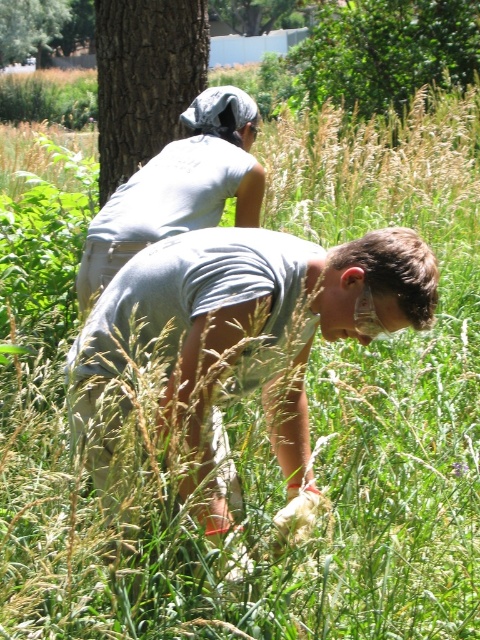
You are a photographer trying to capture both the gray matte shirt at upper center and the brown rough tree trunk at upper left in the same frame. Based on their heights, will the tree trunk appear taller than the shirt in the photo?

The gray matte shirt at upper center is shorter than the brown rough tree trunk at upper left, so yes, the tree trunk will appear taller than the shirt in the photo.

You are a photographer trying to capture both the gray matte shirt at upper center and the brown rough tree at upper left in the same frame. Based on their sizes, which object should you focus on first to ensure both fit in the photo?

The gray matte shirt at upper center is wider than the brown rough tree at upper left. To ensure both fit in the photo, focus on framing the wider gray matte shirt at upper center first, then adjust to include the narrower brown rough tree at upper left.

You are a photographer trying to capture both points in the scene. Which point, point (228,150) or point (27,28), will appear larger in your photo?

Point (228,150) will appear larger in the photo because it is closer to the camera than point (27,28).